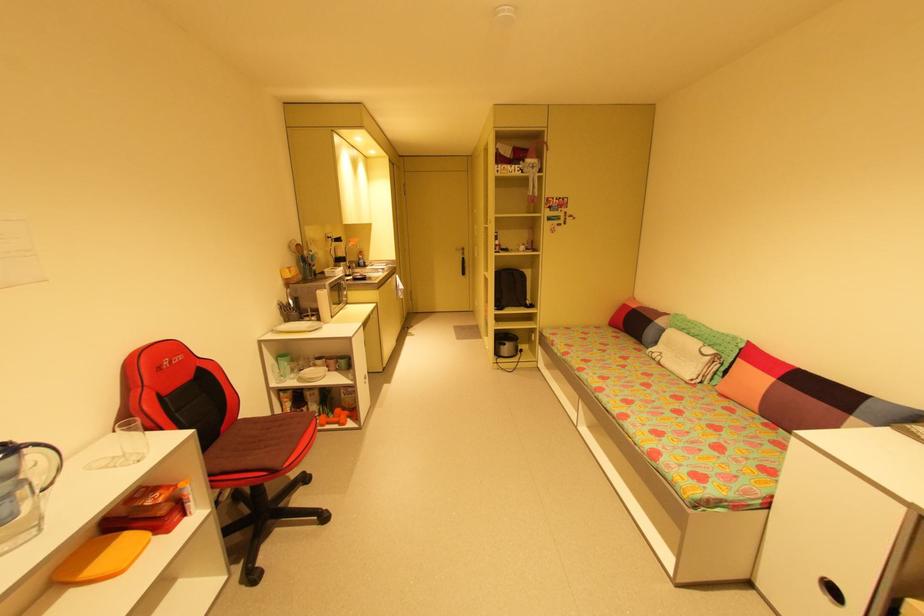
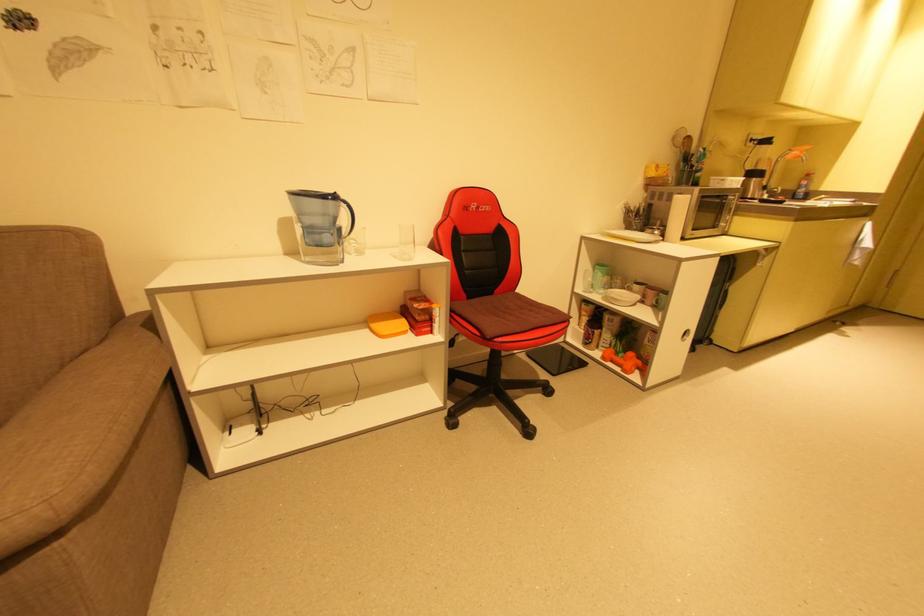
Locate, in the second image, the point that corresponds to the point at 30,450 in the first image.

(346, 204)